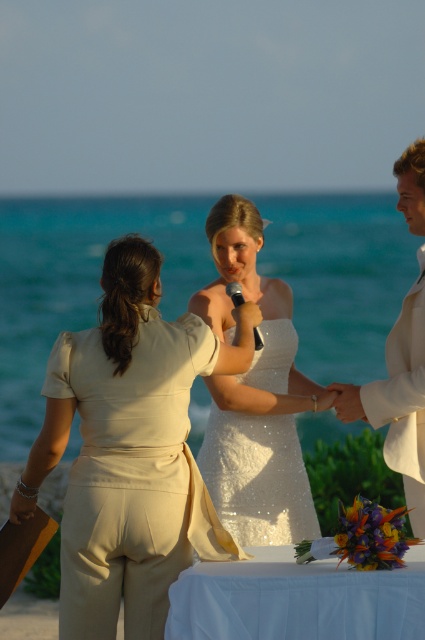
You are a photographer positioned behind the beige satin jumpsuit at center and the white satin suit at right. You need to capture a photo of both outfits clearly. Given that your camera has a minimum focus distance of 1 meter, will you be able to focus on both outfits simultaneously?

The beige satin jumpsuit at center is 1.03 meters away from the white satin suit at right. Since the distance between them is slightly over 1 meter, the camera can focus on both outfits as they are within the minimum focus distance requirement.

You are a photographer at the beachside wedding. You need to capture a photo of the beige satin jumpsuit at center and the white sequined dress at center. Which one is on the left side when facing the couple?

The beige satin jumpsuit at center is positioned on the left side of the white sequined dress at center, so when facing the couple, the beige satin jumpsuit at center is on the left.